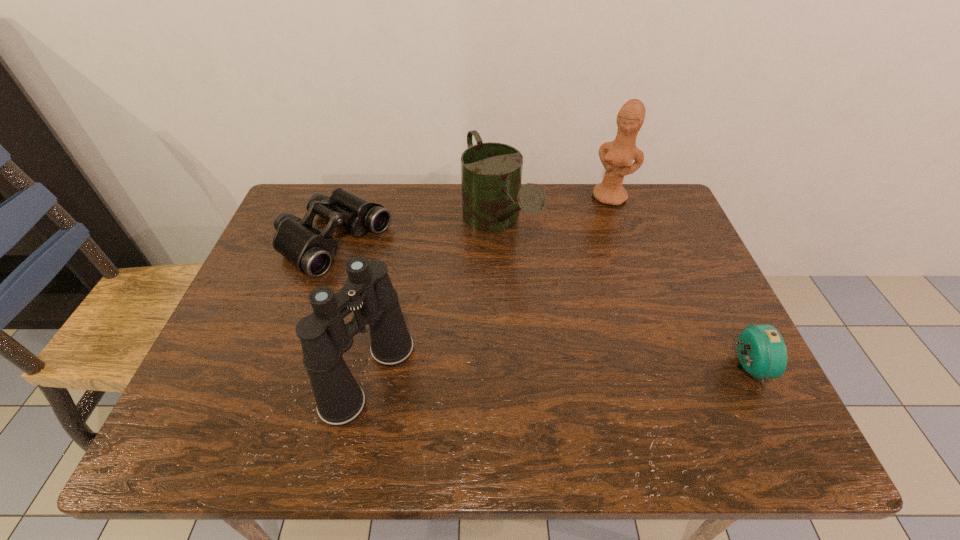
The width and height of the screenshot is (960, 540). In order to click on alarm clock at the near edge in this screenshot , I will do `click(762, 353)`.

I want to click on object at the left edge, so click(309, 250).

At what (x,y) coordinates should I click in order to perform the action: click on alarm clock present at the right edge. Please return your answer as a coordinate pair (x, y). This screenshot has height=540, width=960. Looking at the image, I should click on 762,353.

This screenshot has height=540, width=960. What are the coordinates of `figurine situated at the right edge` in the screenshot? It's located at (617, 157).

In order to click on object located at the far left corner in this screenshot , I will do `click(309, 250)`.

This screenshot has height=540, width=960. I want to click on object located at the far right corner, so click(x=617, y=157).

The width and height of the screenshot is (960, 540). Identify the location of object that is at the near right corner. (762, 353).

This screenshot has height=540, width=960. What are the coordinates of `vacant region at the far edge` in the screenshot? It's located at (433, 220).

Find the location of a particular element. The height and width of the screenshot is (540, 960). free region at the left edge of the desktop is located at coordinates (227, 357).

Where is `blank space at the right edge of the desktop`? This screenshot has height=540, width=960. blank space at the right edge of the desktop is located at coordinates (710, 293).